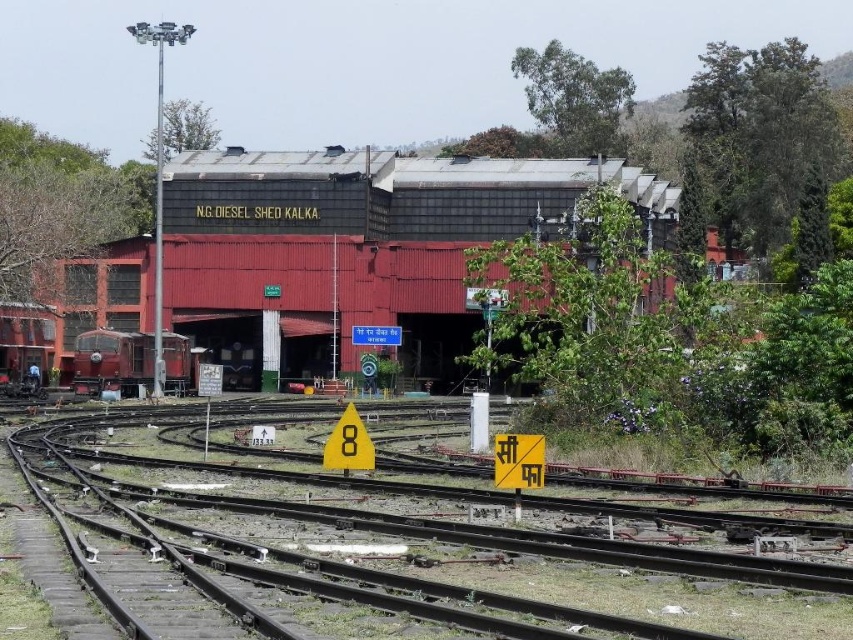
Question: Based on their relative distances, which object is farther from the black metal train track at center?

Choices:
 (A) matte red train at center
 (B) metallic red train shed at center

Answer: (B)

Question: Which point is closer to the camera?

Choices:
 (A) (836, 611)
 (B) (97, 369)

Answer: (A)

Question: Which point is farther from the camera taking this photo?

Choices:
 (A) (73, 371)
 (B) (416, 276)
 (C) (67, 468)

Answer: (B)

Question: Does metallic red train shed at center come in front of matte red train at center?

Choices:
 (A) no
 (B) yes

Answer: (B)

Question: Can you confirm if metallic red train shed at center is wider than matte red train at center?

Choices:
 (A) yes
 (B) no

Answer: (A)

Question: From the image, what is the correct spatial relationship of metallic red train shed at center in relation to matte red train at center?

Choices:
 (A) right
 (B) left

Answer: (A)